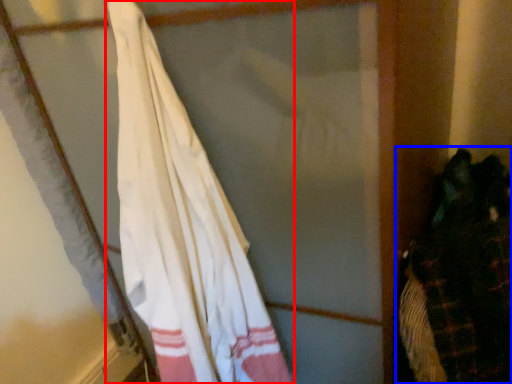
Question: Which object is closer to the camera taking this photo, curtain (highlighted by a red box) or laundry (highlighted by a blue box)?

Choices:
 (A) curtain
 (B) laundry

Answer: (A)